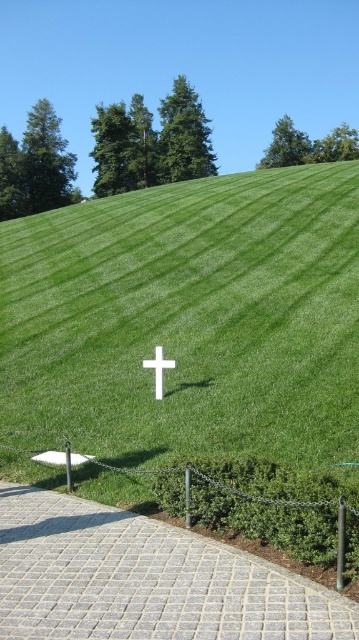
Question: Considering the relative positions of gray cobblestone path at lower center and white matte cross at center in the image provided, where is gray cobblestone path at lower center located with respect to white matte cross at center?

Choices:
 (A) above
 (B) below

Answer: (B)

Question: Among these objects, which one is farthest from the camera?

Choices:
 (A) white matte cross at center
 (B) gray cobblestone path at lower center

Answer: (A)

Question: Can you confirm if gray cobblestone path at lower center is positioned to the right of white matte cross at center?

Choices:
 (A) no
 (B) yes

Answer: (B)

Question: In this image, where is gray cobblestone path at lower center located relative to white matte cross at center?

Choices:
 (A) left
 (B) right

Answer: (B)

Question: Which point appears farthest from the camera in this image?

Choices:
 (A) (123, 516)
 (B) (156, 387)

Answer: (B)

Question: Which object appears farthest from the camera in this image?

Choices:
 (A) white matte cross at center
 (B) gray cobblestone path at lower center

Answer: (A)